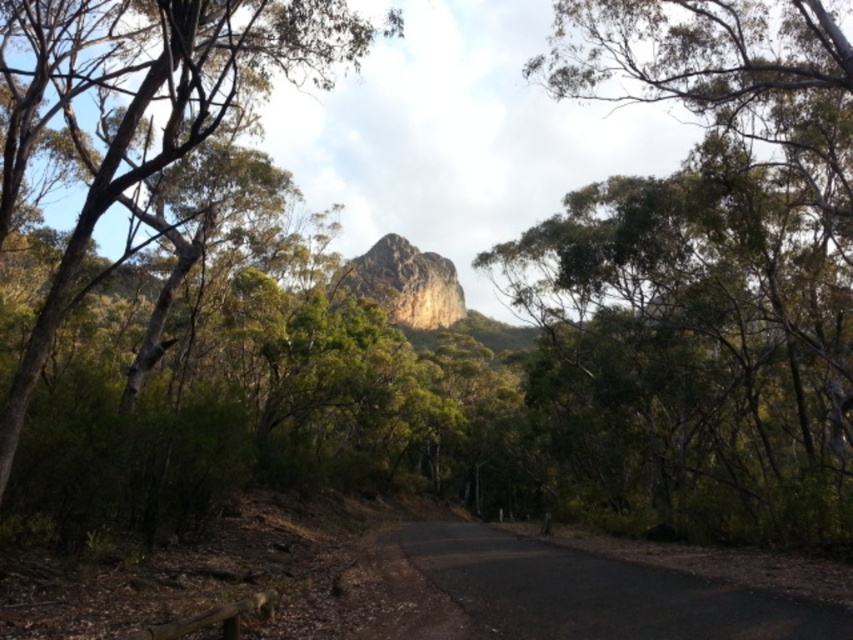
Question: Which object is closer to the camera taking this photo?

Choices:
 (A) green leafy tree at center
 (B) green leafy tree at upper left

Answer: (B)

Question: Is green leafy tree at center behind rugged stone mountain at center?

Choices:
 (A) no
 (B) yes

Answer: (A)

Question: Which object appears farthest from the camera in this image?

Choices:
 (A) green leafy tree at upper left
 (B) rugged stone mountain at center

Answer: (B)

Question: Observing the image, what is the correct spatial positioning of green leafy tree at center in reference to black asphalt road at center?

Choices:
 (A) above
 (B) below

Answer: (A)

Question: Where is green leafy tree at center located in relation to rugged stone mountain at center in the image?

Choices:
 (A) right
 (B) left

Answer: (A)

Question: Which of these objects is positioned farthest from the rugged stone mountain at center?

Choices:
 (A) black asphalt road at center
 (B) green leafy tree at center

Answer: (A)